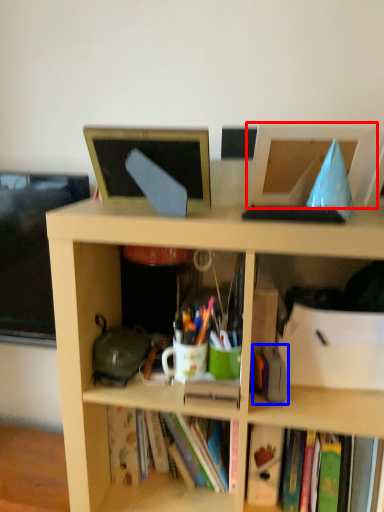
Question: Which point is further to the camera, computer monitor (highlighted by a red box) or stationery (highlighted by a blue box)?

Choices:
 (A) computer monitor
 (B) stationery

Answer: (B)